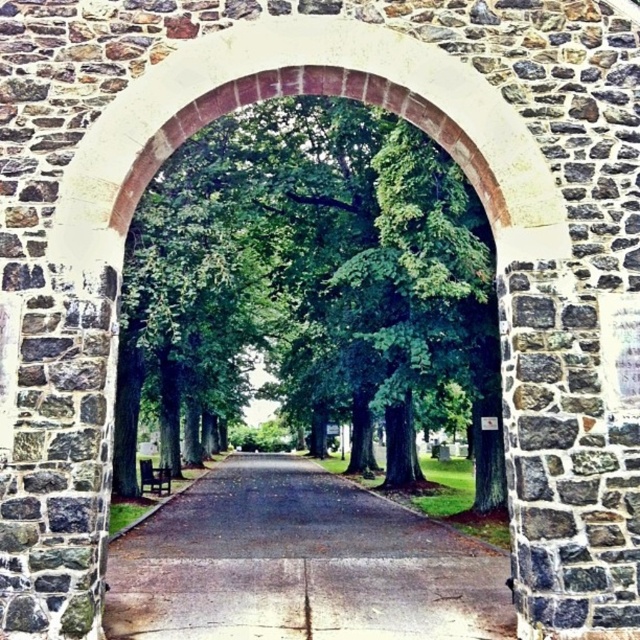
You are standing at the entrance of the stone archway and notice the green leafy tree at center. Based on its position coordinates, can you determine if the tree is positioned closer to the left or right side of the pathway?

The green leafy tree at center is located at point coordinates of 0.433 on the x and 0.486 on the y. Since the coordinates are close to the center, the tree is positioned near the middle of the pathway, not closer to the left or right side.

You are a gardener planning to plant a new tree between the green leafy tree at center and the dark asphalt road at center. Based on their widths, which one should you consider as a reference to ensure proper spacing?

The green leafy tree at center might be wider than the dark asphalt road at center, so you should consider the width of the green leafy tree at center to ensure proper spacing between them.

You are a hiker standing at the entrance of the stone archway and want to know if the green leafy tree at center will block your view of the dark asphalt road at center. Based on their heights, will the tree obscure the road?

The green leafy tree at center is taller than the dark asphalt road at center, so it may block the view of the road depending on its position and spread of branches. However, the question specifically asks about height, so based solely on height, the tree could potentially obscure the road if positioned directly in front of it.